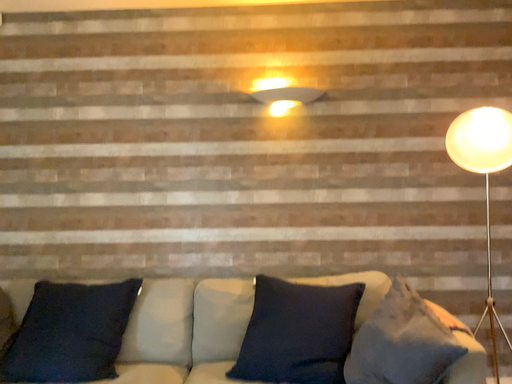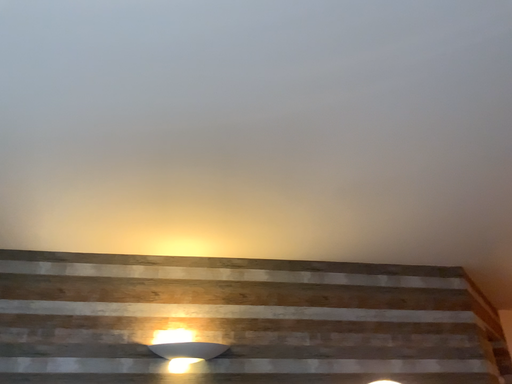
Question: Which way did the camera rotate in the video?

Choices:
 (A) rotated left
 (B) rotated right

Answer: (B)